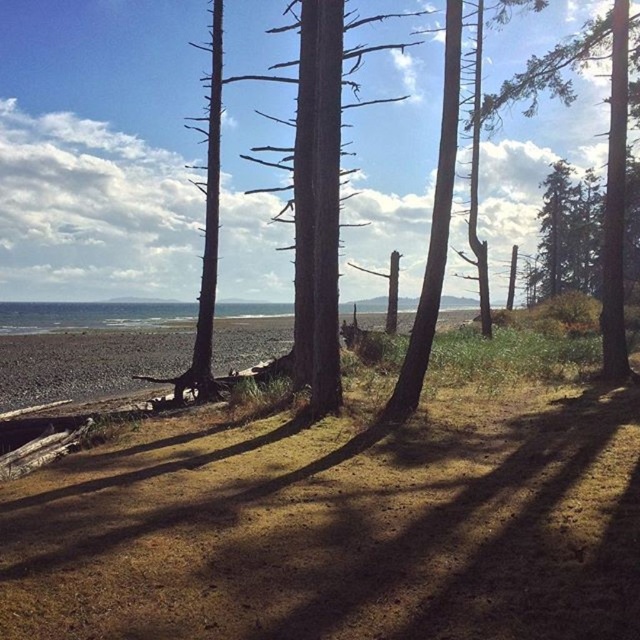
Question: Can you confirm if brown sandy beach at lower left is positioned above green textured tree at center?

Choices:
 (A) no
 (B) yes

Answer: (A)

Question: Which of the following is the farthest from the observer?

Choices:
 (A) (621, 292)
 (B) (148, 371)

Answer: (B)

Question: Considering the relative positions of brown sandy beach at lower left and green textured tree at center in the image provided, where is brown sandy beach at lower left located with respect to green textured tree at center?

Choices:
 (A) left
 (B) right

Answer: (A)

Question: Can you confirm if brown sandy beach at lower left is thinner than green textured tree at center?

Choices:
 (A) no
 (B) yes

Answer: (A)